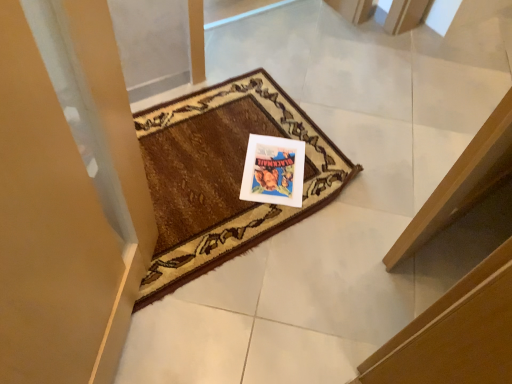
Question: From a real-world perspective, is brown woven mat at center under white glossy picture frame at center?

Choices:
 (A) yes
 (B) no

Answer: (B)

Question: Is brown woven mat at center at the left side of white glossy picture frame at center?

Choices:
 (A) no
 (B) yes

Answer: (B)

Question: From the image's perspective, would you say brown woven mat at center is shown under white glossy picture frame at center?

Choices:
 (A) yes
 (B) no

Answer: (B)

Question: Does brown woven mat at center have a greater width compared to white glossy picture frame at center?

Choices:
 (A) no
 (B) yes

Answer: (B)

Question: Can you confirm if brown woven mat at center is bigger than white glossy picture frame at center?

Choices:
 (A) no
 (B) yes

Answer: (B)

Question: Can you confirm if brown woven mat at center is thinner than white glossy picture frame at center?

Choices:
 (A) yes
 (B) no

Answer: (B)

Question: Considering the relative sizes of white glossy picture frame at center and brown woven mat at center in the image provided, is white glossy picture frame at center shorter than brown woven mat at center?

Choices:
 (A) no
 (B) yes

Answer: (B)

Question: Can you confirm if white glossy picture frame at center is smaller than brown woven mat at center?

Choices:
 (A) no
 (B) yes

Answer: (B)

Question: Is white glossy picture frame at center positioned beyond the bounds of brown woven mat at center?

Choices:
 (A) yes
 (B) no

Answer: (B)

Question: From the image's perspective, is white glossy picture frame at center located above brown woven mat at center?

Choices:
 (A) yes
 (B) no

Answer: (B)

Question: Does white glossy picture frame at center have a greater width compared to brown woven mat at center?

Choices:
 (A) no
 (B) yes

Answer: (A)

Question: Is white glossy picture frame at center taller than brown woven mat at center?

Choices:
 (A) yes
 (B) no

Answer: (B)

Question: Considering their positions, is brown woven mat at center located in front of or behind white glossy picture frame at center?

Choices:
 (A) behind
 (B) front

Answer: (B)